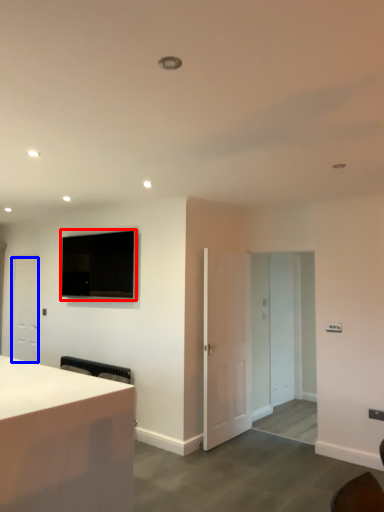
Question: Which object appears closest to the camera in this image, television (highlighted by a red box) or door (highlighted by a blue box)?

Choices:
 (A) television
 (B) door

Answer: (A)